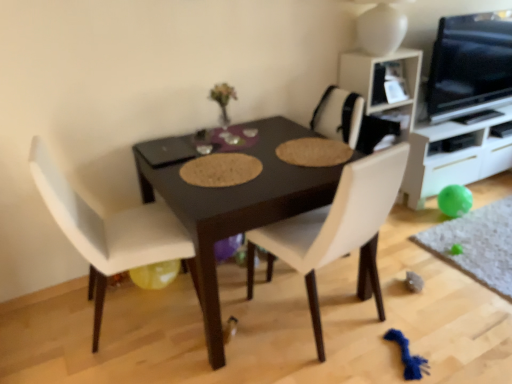
Question: From the image's perspective, is white glossy cabinet at right located beneath yellow rubber balloon at lower left?

Choices:
 (A) no
 (B) yes

Answer: (A)

Question: Considering the relative sizes of white glossy cabinet at right and yellow rubber balloon at lower left in the image provided, is white glossy cabinet at right taller than yellow rubber balloon at lower left?

Choices:
 (A) yes
 (B) no

Answer: (A)

Question: Is white glossy cabinet at right shorter than yellow rubber balloon at lower left?

Choices:
 (A) yes
 (B) no

Answer: (B)

Question: Is white glossy cabinet at right closer to camera compared to yellow rubber balloon at lower left?

Choices:
 (A) no
 (B) yes

Answer: (A)

Question: Are white glossy cabinet at right and yellow rubber balloon at lower left located far from each other?

Choices:
 (A) yes
 (B) no

Answer: (A)

Question: From their relative heights in the image, would you say white leather chair at left, the 1th chair in the left-to-right sequence, is taller or shorter than white glossy cabinet at right?

Choices:
 (A) tall
 (B) short

Answer: (A)

Question: Considering the positions of white leather chair at left, the 1th chair in the left-to-right sequence, and white glossy cabinet at right in the image, is white leather chair at left, the 1th chair in the left-to-right sequence, wider or thinner than white glossy cabinet at right?

Choices:
 (A) wide
 (B) thin

Answer: (A)

Question: Considering the positions of white leather chair at left, the 1th chair in the left-to-right sequence, and white glossy cabinet at right in the image, is white leather chair at left, the 1th chair in the left-to-right sequence, bigger or smaller than white glossy cabinet at right?

Choices:
 (A) small
 (B) big

Answer: (A)

Question: Based on their positions, is white leather chair at left, the 1th chair in the left-to-right sequence, located to the left or right of white glossy cabinet at right?

Choices:
 (A) left
 (B) right

Answer: (A)

Question: From the image's perspective, is green rubber ball at lower right above or below white glossy cabinet at right?

Choices:
 (A) below
 (B) above

Answer: (A)

Question: Would you say green rubber ball at lower right is to the left or to the right of white glossy cabinet at right in the picture?

Choices:
 (A) right
 (B) left

Answer: (A)

Question: Is point (471, 215) positioned closer to the camera than point (488, 127)?

Choices:
 (A) farther
 (B) closer

Answer: (B)

Question: Looking at the image, does green rubber ball at lower right seem bigger or smaller compared to white glossy cabinet at right?

Choices:
 (A) small
 (B) big

Answer: (A)

Question: Considering the positions of white leather chair at center, the first chair positioned from the right, and yellow rubber balloon at lower left in the image, is white leather chair at center, the first chair positioned from the right, taller or shorter than yellow rubber balloon at lower left?

Choices:
 (A) short
 (B) tall

Answer: (B)

Question: From a real-world perspective, relative to yellow rubber balloon at lower left, is white leather chair at center, the first chair positioned from the right, vertically above or below?

Choices:
 (A) above
 (B) below

Answer: (A)